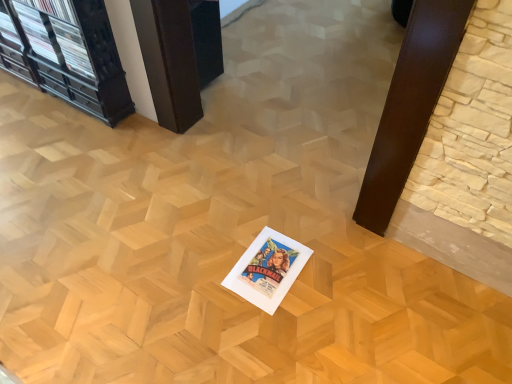
Question: In the image, is wooden at center on the left side or the right side of white paper at center?

Choices:
 (A) left
 (B) right

Answer: (A)

Question: Is wooden at center bigger or smaller than white paper at center?

Choices:
 (A) small
 (B) big

Answer: (B)

Question: From a real-world perspective, is wooden at center physically located above or below white paper at center?

Choices:
 (A) below
 (B) above

Answer: (B)

Question: Based on their positions, is white paper at center located to the left or right of wooden at center?

Choices:
 (A) left
 (B) right

Answer: (B)

Question: Is white paper at center taller or shorter than wooden at center?

Choices:
 (A) tall
 (B) short

Answer: (B)

Question: Is point (278, 264) positioned closer to the camera than point (157, 105)?

Choices:
 (A) farther
 (B) closer

Answer: (B)

Question: Considering the positions of white paper at center and wooden at center in the image, is white paper at center wider or thinner than wooden at center?

Choices:
 (A) wide
 (B) thin

Answer: (B)